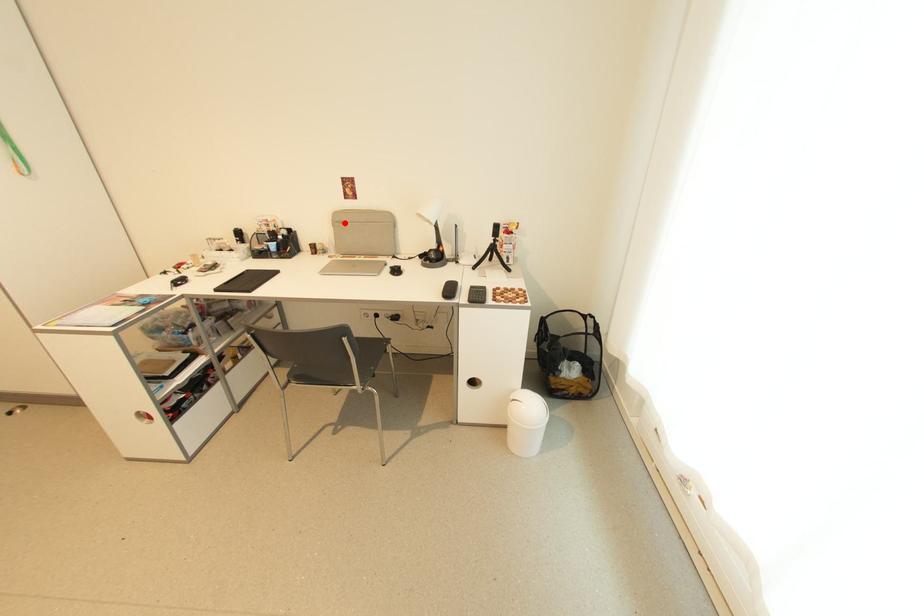
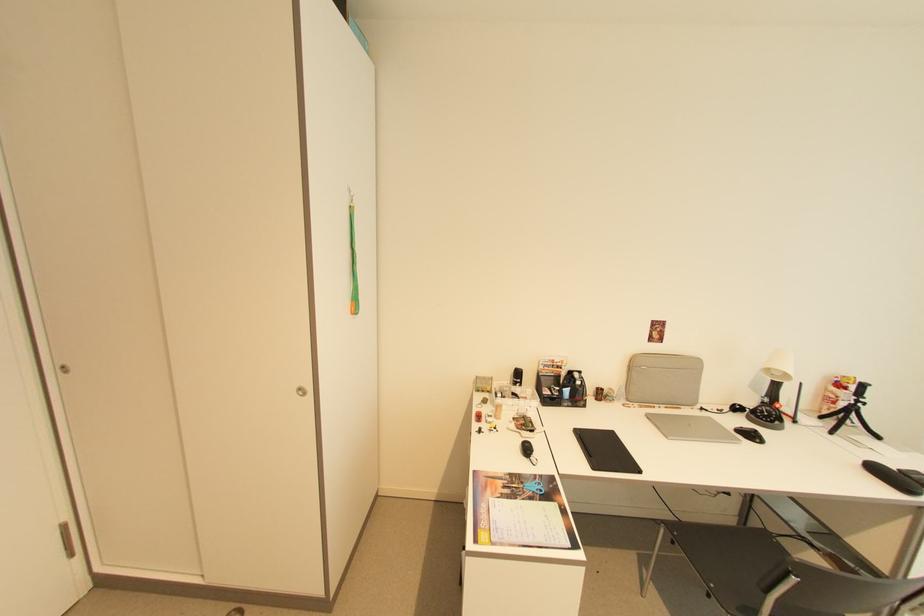
In the second image, find the point that corresponds to the highlighted location in the first image.

(638, 366)